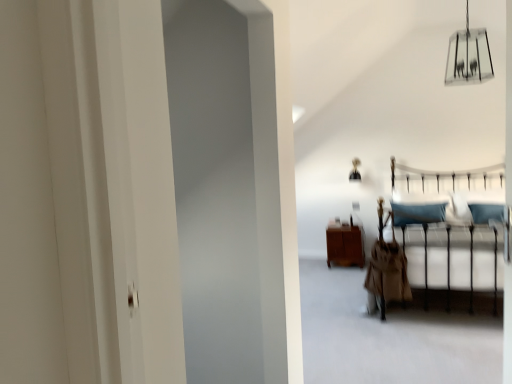
Question: Is clear glass chandelier at upper center, the 2th lamp in the left-to-right sequence, in contact with metallic gold lamp at upper center, which is the 1th lamp in back-to-front order?

Choices:
 (A) no
 (B) yes

Answer: (A)

Question: Is clear glass chandelier at upper center, the 1th lamp in the top-to-bottom sequence, further to camera compared to metallic gold lamp at upper center, which is the 1th lamp in back-to-front order?

Choices:
 (A) yes
 (B) no

Answer: (B)

Question: Is clear glass chandelier at upper center, the 1th lamp in the top-to-bottom sequence, taller than metallic gold lamp at upper center, positioned as the first lamp in left-to-right order?

Choices:
 (A) yes
 (B) no

Answer: (A)

Question: Can you confirm if clear glass chandelier at upper center, the 2th lamp in the left-to-right sequence, is bigger than metallic gold lamp at upper center, which is the 1th lamp in back-to-front order?

Choices:
 (A) no
 (B) yes

Answer: (B)

Question: From a real-world perspective, is clear glass chandelier at upper center, arranged as the 1th lamp when viewed from the right, beneath metallic gold lamp at upper center, which is the 2th lamp from right to left?

Choices:
 (A) no
 (B) yes

Answer: (A)

Question: In terms of width, does clear glass chandelier at upper center, arranged as the second lamp when ordered from the bottom, look wider or thinner when compared to metallic gold lamp at upper center, positioned as the first lamp in left-to-right order?

Choices:
 (A) wide
 (B) thin

Answer: (A)

Question: In the image, is clear glass chandelier at upper center, the 2th lamp viewed from the back, positioned in front of or behind metallic gold lamp at upper center, which is the 1th lamp in back-to-front order?

Choices:
 (A) behind
 (B) front

Answer: (B)

Question: In terms of height, does clear glass chandelier at upper center, arranged as the second lamp when ordered from the bottom, look taller or shorter compared to metallic gold lamp at upper center, the 2th lamp in the front-to-back sequence?

Choices:
 (A) tall
 (B) short

Answer: (A)

Question: Do you think clear glass chandelier at upper center, the 1th lamp in the top-to-bottom sequence, is within metallic gold lamp at upper center, which is the 2th lamp from right to left, or outside of it?

Choices:
 (A) outside
 (B) inside

Answer: (A)

Question: From a real-world perspective, is brown wood cabinet at center above or below metallic silver bed frame at center?

Choices:
 (A) above
 (B) below

Answer: (B)

Question: From the image's perspective, is brown wood cabinet at center above or below metallic silver bed frame at center?

Choices:
 (A) below
 (B) above

Answer: (A)

Question: Which is correct: brown wood cabinet at center is inside metallic silver bed frame at center, or outside of it?

Choices:
 (A) inside
 (B) outside

Answer: (B)

Question: Considering the positions of brown wood cabinet at center and metallic silver bed frame at center in the image, is brown wood cabinet at center taller or shorter than metallic silver bed frame at center?

Choices:
 (A) tall
 (B) short

Answer: (B)

Question: From a real-world perspective, is brown wood cabinet at center positioned above or below clear glass chandelier at upper center, arranged as the second lamp when ordered from the bottom?

Choices:
 (A) above
 (B) below

Answer: (B)

Question: Choose the correct answer: Is brown wood cabinet at center inside clear glass chandelier at upper center, arranged as the second lamp when ordered from the bottom, or outside it?

Choices:
 (A) outside
 (B) inside

Answer: (A)